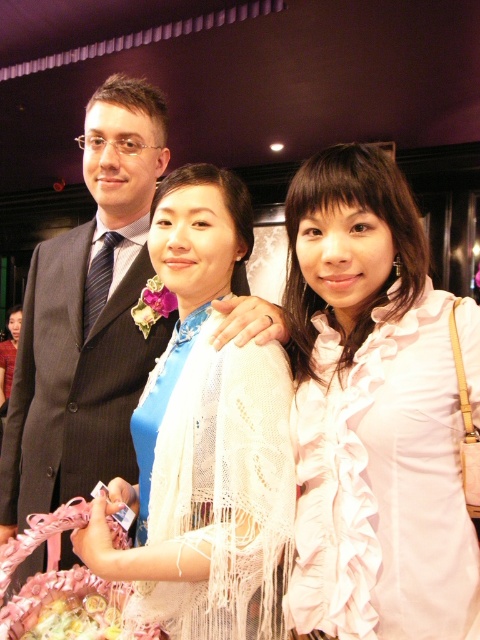
You are a photographer adjusting the camera focus. The white frilly dress at center and the white lace shawl at center are both in the frame. Which object should you focus on first if you want to ensure the taller one is sharp?

A: You should focus on the white frilly dress at center first because it is much taller than the white lace shawl at center, making it the primary subject for sharp focus.

In the image, there are a white frilly dress at center and a white lace shawl at center. Which one is positioned higher?

The white frilly dress at center is located above the white lace shawl at center, so the white frilly dress at center is higher.